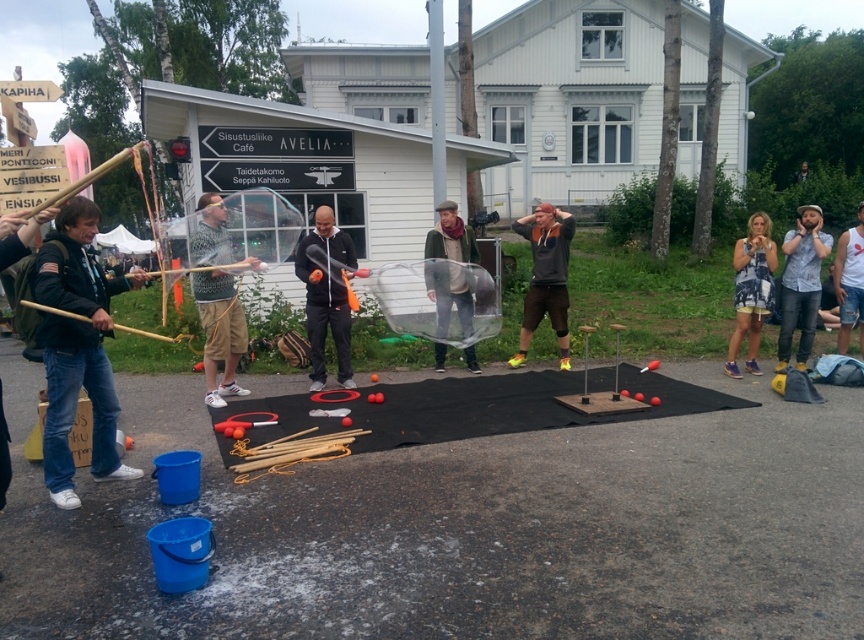
Question: Can you confirm if black matte jacket at center is positioned to the left of matte gray bubble at center?

Choices:
 (A) no
 (B) yes

Answer: (B)

Question: Which point appears closest to the camera in this image?

Choices:
 (A) (840, 248)
 (B) (467, 307)
 (C) (540, 234)
 (D) (811, 269)

Answer: (D)

Question: Does black matte jacket at center appear on the right side of white cotton tank top at right?

Choices:
 (A) no
 (B) yes

Answer: (A)

Question: Considering the real-world distances, which object is farthest from the orange fabric at center?

Choices:
 (A) patterned fabric shirt at center
 (B) white cotton tank top at right
 (C) denim shirt at right

Answer: (B)

Question: Is the position of denim jacket at left less distant than that of blue printed dress at right?

Choices:
 (A) no
 (B) yes

Answer: (B)

Question: Which object is farther from the camera taking this photo?

Choices:
 (A) denim shirt at right
 (B) matte gray bubble at center
 (C) black matte jacket at center

Answer: (B)